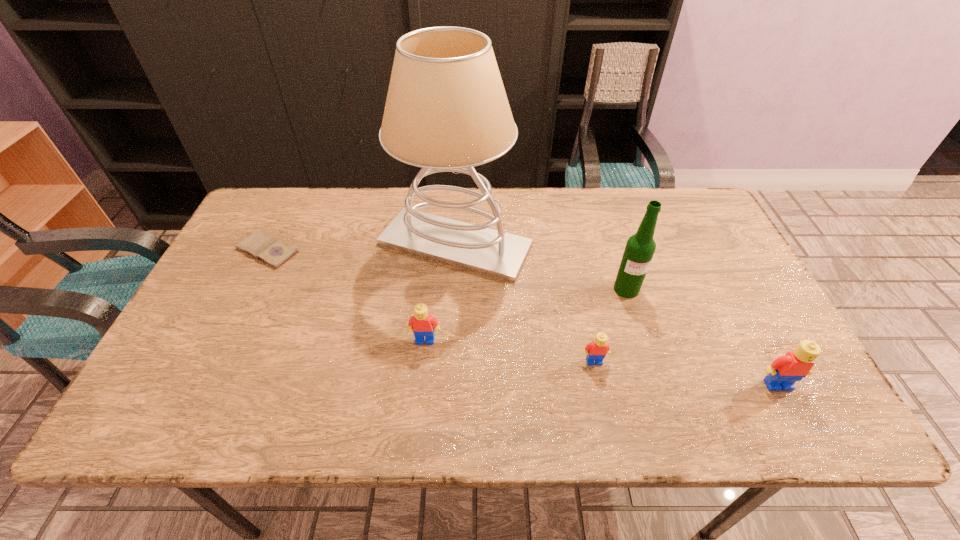
This screenshot has width=960, height=540. Find the location of `vacant point located between the fifth tallest object and the fifth shortest object`. vacant point located between the fifth tallest object and the fifth shortest object is located at coordinates (611, 326).

Identify the location of vacant area that lies between the leftmost object and the shortest Lego. The image size is (960, 540). (431, 306).

The width and height of the screenshot is (960, 540). I want to click on free spot between the nearest Lego and the shortest object, so click(x=522, y=318).

Where is `free space between the fourth object from left to right and the leftmost object`? free space between the fourth object from left to right and the leftmost object is located at coordinates (431, 306).

I want to click on object that is the fifth closest to the tallest object, so click(x=784, y=371).

Locate which object ranks second in proximity to the nearest object. Please provide its 2D coordinates. Your answer should be formatted as a tuple, i.e. [(x, y)], where the tuple contains the x and y coordinates of a point satisfying the conditions above.

[(596, 350)]

This screenshot has width=960, height=540. What are the coordinates of `the closest Lego to the nearest Lego` in the screenshot? It's located at (596, 350).

Point out which Lego is positioned as the second nearest to the second Lego from left to right. Please provide its 2D coordinates. Your answer should be formatted as a tuple, i.e. [(x, y)], where the tuple contains the x and y coordinates of a point satisfying the conditions above.

[(421, 324)]